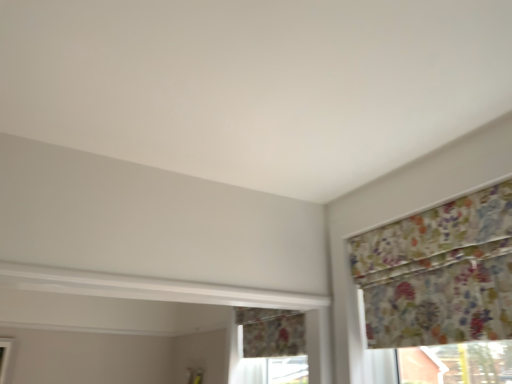
This screenshot has width=512, height=384. Describe the element at coordinates (270, 347) in the screenshot. I see `floral fabric window at center` at that location.

Identify the location of floral fabric window at center. (270, 347).

Image resolution: width=512 pixels, height=384 pixels. What do you see at coordinates (439, 273) in the screenshot? I see `floral fabric curtain at upper right` at bounding box center [439, 273].

What is the approximate height of floral fabric curtain at upper right?

It is 22.59 inches.

What are the coordinates of `floral fabric curtain at upper right` in the screenshot? It's located at (439, 273).

Image resolution: width=512 pixels, height=384 pixels. I want to click on floral fabric window at center, so click(x=270, y=347).

Which object is positioned more to the left, floral fabric curtain at upper right or floral fabric window at center?

From the viewer's perspective, floral fabric window at center appears more on the left side.

Who is more distant, floral fabric curtain at upper right or floral fabric window at center?

floral fabric window at center.

Between point (503, 185) and point (292, 319), which one is positioned in front?

Point (503, 185)

From the image's perspective, is floral fabric curtain at upper right above or below floral fabric window at center?

From the image's perspective, floral fabric curtain at upper right appears above floral fabric window at center.

From a real-world perspective, relative to floral fabric window at center, is floral fabric curtain at upper right vertically above or below?

floral fabric curtain at upper right is situated higher than floral fabric window at center in the real world.

In terms of width, does floral fabric curtain at upper right look wider or thinner when compared to floral fabric window at center?

Clearly, floral fabric curtain at upper right has less width compared to floral fabric window at center.

Is floral fabric curtain at upper right taller than floral fabric window at center?

Indeed, floral fabric curtain at upper right has a greater height compared to floral fabric window at center.

Which of these two, floral fabric curtain at upper right or floral fabric window at center, is bigger?

floral fabric window at center.

Is floral fabric window at center inside floral fabric curtain at upper right?

No, floral fabric window at center is not inside floral fabric curtain at upper right.

Is floral fabric curtain at upper right far from floral fabric window at center?

No.

Is floral fabric curtain at upper right oriented towards floral fabric window at center?

No, floral fabric curtain at upper right is not oriented towards floral fabric window at center.

What's the angular difference between floral fabric curtain at upper right and floral fabric window at center's facing directions?

The angle between the facing direction of floral fabric curtain at upper right and the facing direction of floral fabric window at center is 0.000749 degrees.

Locate an element on the screen. This screenshot has height=384, width=512. curtain lying above the floral fabric window at center (from the image's perspective) is located at coordinates (439, 273).

Based on their positions, is floral fabric window at center located to the left or right of floral fabric curtain at upper right?

floral fabric window at center is to the left of floral fabric curtain at upper right.

Does floral fabric window at center come behind floral fabric curtain at upper right?

Yes, it is.

Is point (243, 318) closer or farther from the camera than point (394, 289)?

Clearly, point (243, 318) is more distant from the camera than point (394, 289).

From the image's perspective, is floral fabric window at center located beneath floral fabric curtain at upper right?

Yes, from the image's perspective, floral fabric window at center is beneath floral fabric curtain at upper right.

From a real-world perspective, is floral fabric window at center on top of floral fabric curtain at upper right?

No, from a real-world perspective, floral fabric window at center is not above floral fabric curtain at upper right.

Is floral fabric window at center wider or thinner than floral fabric curtain at upper right?

In the image, floral fabric window at center appears to be wider than floral fabric curtain at upper right.

Is floral fabric window at center taller than floral fabric curtain at upper right?

In fact, floral fabric window at center may be shorter than floral fabric curtain at upper right.

Based on their sizes in the image, would you say floral fabric window at center is bigger or smaller than floral fabric curtain at upper right?

In the image, floral fabric window at center appears to be larger than floral fabric curtain at upper right.

Is floral fabric window at center situated inside floral fabric curtain at upper right or outside?

floral fabric window at center is outside floral fabric curtain at upper right.

Is floral fabric window at center not near floral fabric curtain at upper right?

floral fabric window at center is actually quite close to floral fabric curtain at upper right.

Is floral fabric window at center facing away from floral fabric curtain at upper right?

No, floral fabric curtain at upper right is not at the back of floral fabric window at center.

The height and width of the screenshot is (384, 512). I want to click on curtain positioned vertically above the floral fabric window at center (from a real-world perspective), so click(x=439, y=273).

This screenshot has width=512, height=384. What are the coordinates of `curtain in front of the floral fabric window at center` in the screenshot? It's located at (439, 273).

Identify the location of window on the left of floral fabric curtain at upper right. (x=270, y=347).